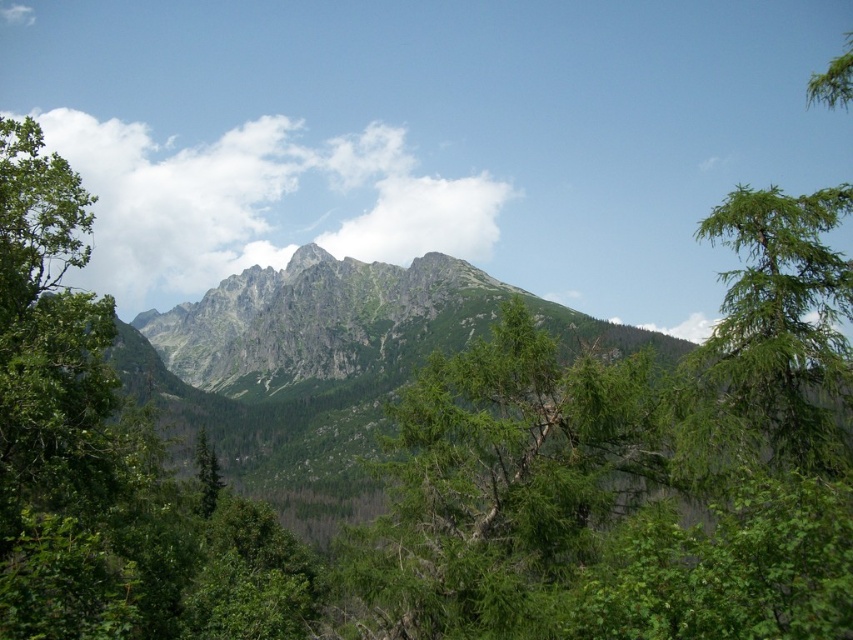
Question: Where is green needle-like tree at center located in relation to green needle-like tree at right in the image?

Choices:
 (A) above
 (B) below

Answer: (B)

Question: Which point is farther to the camera?

Choices:
 (A) green needle-like tree at right
 (B) green needle-like tree at center

Answer: (A)

Question: In this image, where is green needle-like tree at center located relative to green needle-like tree at right?

Choices:
 (A) above
 (B) below

Answer: (B)

Question: Can you confirm if green needle-like tree at center is positioned to the left of green needle-like tree at right?

Choices:
 (A) no
 (B) yes

Answer: (B)

Question: Which point is farther from the camera taking this photo?

Choices:
 (A) pyautogui.click(x=399, y=422)
 (B) pyautogui.click(x=848, y=368)

Answer: (A)

Question: Which of the following is the farthest from the observer?

Choices:
 (A) (724, 362)
 (B) (461, 410)

Answer: (B)